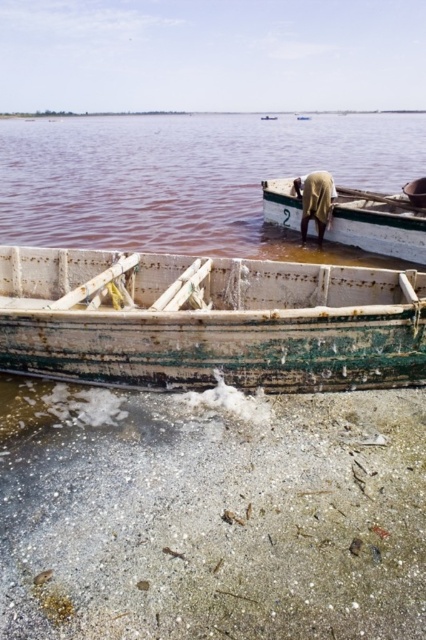
Between point (357, 529) and point (235, 291), which one is positioned behind?

Positioned behind is point (235, 291).

I want to click on white sandy shore at lower center, so click(212, 513).

Locate an element on the screen. white sandy shore at lower center is located at coordinates (212, 513).

The width and height of the screenshot is (426, 640). Identify the location of white sandy shore at lower center. (212, 513).

Based on the photo, which is below, pink water at center or rusty wood boat at center?

rusty wood boat at center is below.

Between pink water at center and rusty wood boat at center, which one is positioned higher?

pink water at center

Is point (336, 204) positioned in front of point (293, 227)?

Yes.

The image size is (426, 640). What are the coordinates of `pink water at center` in the screenshot? It's located at (189, 179).

Between point (112, 305) and point (207, 209), which one is positioned in front?

Point (112, 305) is more forward.

The width and height of the screenshot is (426, 640). What do you see at coordinates (209, 321) in the screenshot? I see `rusty wood boat at lower center` at bounding box center [209, 321].

Identify the location of rusty wood boat at lower center. coord(209,321).